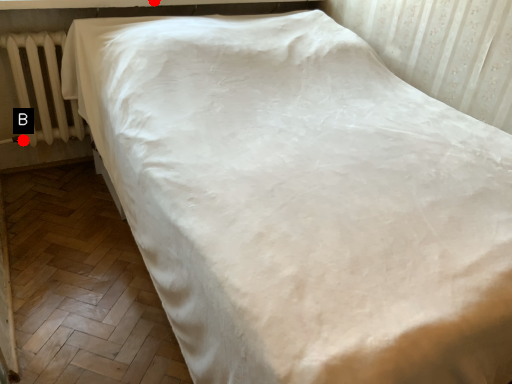
Question: Two points are circled on the image, labeled by A and B beside each circle. Which of the following is the farthest from the observer?

Choices:
 (A) A is further
 (B) B is further

Answer: (B)